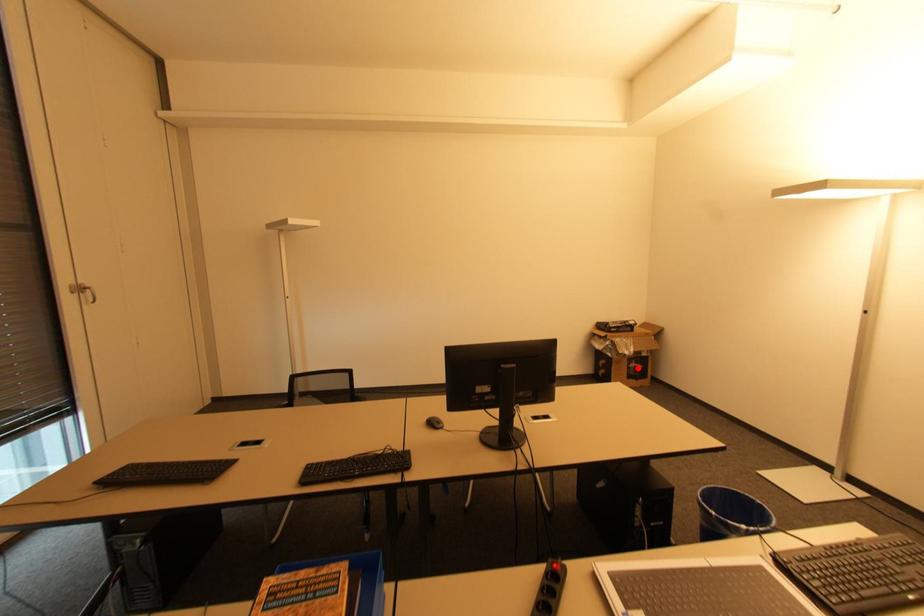
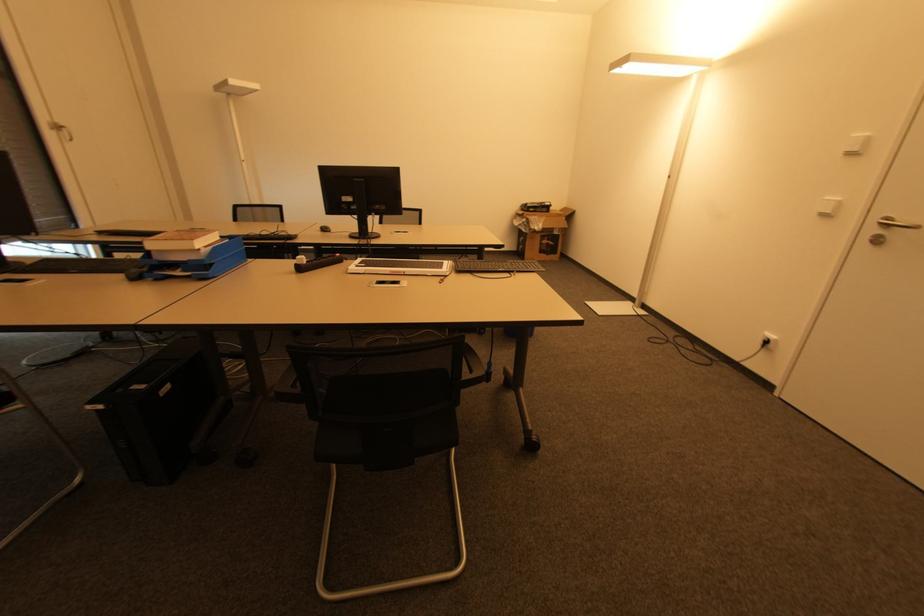
Question: I am providing you with two images of the same scene from different viewpoints. Given a red point in image1, look at the same physical point in image2. Is it:

Choices:
 (A) Closer to the viewpoint
 (B) Farther from the viewpoint

Answer: (A)